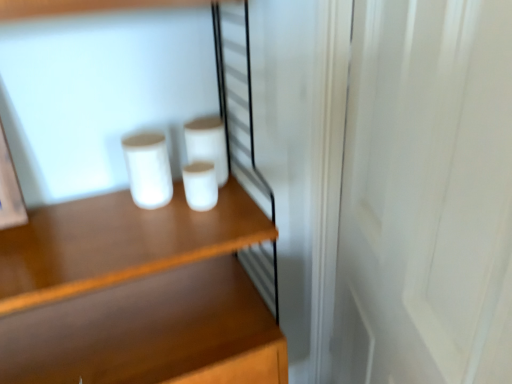
Question: Considering the relative positions of white matte cup at center, the 3th paper towel positioned from the right, and white matte paper towel at center, positioned as the 2th paper towel in right-to-left order, in the image provided, is white matte cup at center, the 3th paper towel positioned from the right, to the left of white matte paper towel at center, positioned as the 2th paper towel in right-to-left order, from the viewer's perspective?

Choices:
 (A) yes
 (B) no

Answer: (A)

Question: Could white matte paper towel at center, positioned as the 2th paper towel in right-to-left order, be considered to be inside white matte cup at center, the 3th paper towel positioned from the right?

Choices:
 (A) no
 (B) yes

Answer: (A)

Question: Is white matte cup at center, acting as the 1th paper towel starting from the left, closer to camera compared to white matte paper towel at center, positioned as the 2th paper towel in right-to-left order?

Choices:
 (A) yes
 (B) no

Answer: (A)

Question: From a real-world perspective, is white matte cup at center, acting as the 1th paper towel starting from the left, located higher than white matte paper towel at center, positioned as the 2th paper towel in right-to-left order?

Choices:
 (A) no
 (B) yes

Answer: (B)

Question: From a real-world perspective, does white matte cup at center, the 3th paper towel positioned from the right, sit lower than white matte paper towel at center, positioned as the 2th paper towel in right-to-left order?

Choices:
 (A) yes
 (B) no

Answer: (B)

Question: Are white matte cup at center, the 3th paper towel positioned from the right, and white matte paper towel at center, the second paper towel from the left, beside each other?

Choices:
 (A) yes
 (B) no

Answer: (B)

Question: Is wooden shelf at center completely or partially inside white wood screen door at right?

Choices:
 (A) no
 (B) yes

Answer: (A)

Question: Can you confirm if white wood screen door at right is smaller than wooden shelf at center?

Choices:
 (A) no
 (B) yes

Answer: (A)

Question: Is white wood screen door at right wider than wooden shelf at center?

Choices:
 (A) no
 (B) yes

Answer: (B)

Question: Is white wood screen door at right at the right side of wooden shelf at center?

Choices:
 (A) yes
 (B) no

Answer: (A)

Question: Is white wood screen door at right with wooden shelf at center?

Choices:
 (A) yes
 (B) no

Answer: (B)

Question: From the image's perspective, does white wood screen door at right appear higher than wooden shelf at center?

Choices:
 (A) no
 (B) yes

Answer: (B)

Question: Can you confirm if white matte cup at center, arranged as the 1th paper towel when viewed from the right, is thinner than white matte paper towel at center, the second paper towel from the left?

Choices:
 (A) no
 (B) yes

Answer: (B)